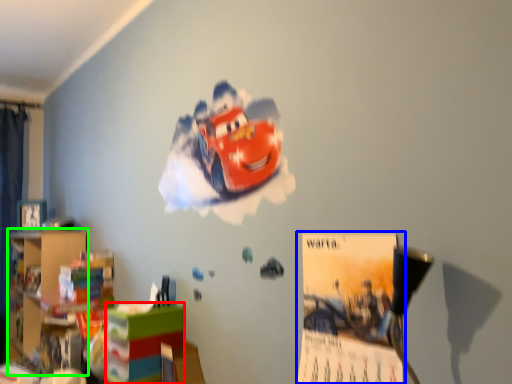
Question: Which object is positioned farthest from shelf (highlighted by a red box)? Select from poster page (highlighted by a blue box) and bookshelf (highlighted by a green box).

Choices:
 (A) poster page
 (B) bookshelf

Answer: (B)